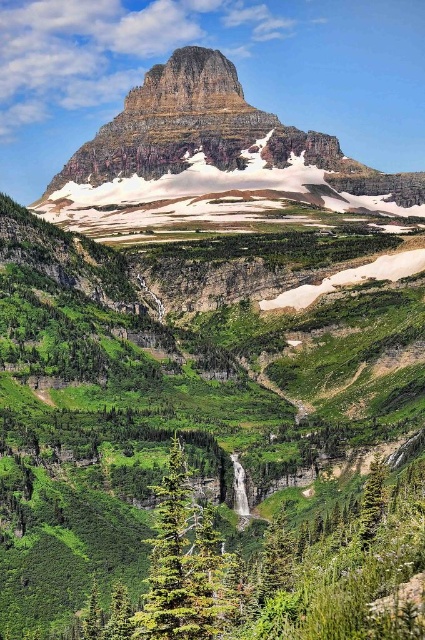
Question: Can you confirm if rugged stone mountain at center is bigger than green textured tree at center?

Choices:
 (A) yes
 (B) no

Answer: (A)

Question: Can you confirm if rugged stone mountain at center is bigger than green textured tree at center?

Choices:
 (A) no
 (B) yes

Answer: (B)

Question: Which point appears farthest from the camera in this image?

Choices:
 (A) (234, 608)
 (B) (192, 128)

Answer: (B)

Question: Considering the relative positions of rugged stone mountain at center and green textured tree at center in the image provided, where is rugged stone mountain at center located with respect to green textured tree at center?

Choices:
 (A) right
 (B) left

Answer: (B)

Question: Which of the following is the farthest from the observer?

Choices:
 (A) green textured tree at center
 (B) rugged stone mountain at center

Answer: (B)